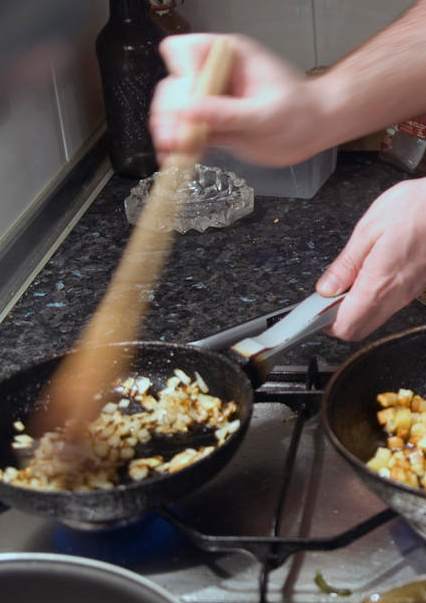
You are a GUI agent. You are given a task and a screenshot of the screen. Output one action in this format:
    pyautogui.click(x=<x>, y=<y>)
    Task: Click on the food in the process of being cooked on the stove
    
    Given the screenshot: What is the action you would take?
    pyautogui.click(x=99, y=466), pyautogui.click(x=187, y=406), pyautogui.click(x=407, y=425), pyautogui.click(x=416, y=476)